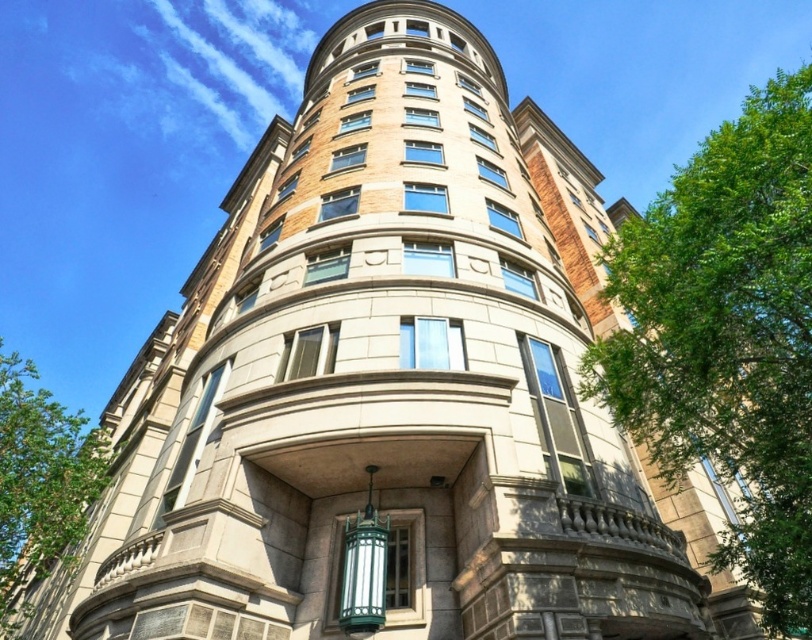
Question: Which of the following is the farthest from the observer?

Choices:
 (A) (98, 456)
 (B) (618, 230)

Answer: (B)

Question: Is green leafy tree at right further to camera compared to green leafy tree at lower left?

Choices:
 (A) yes
 (B) no

Answer: (B)

Question: Which point is farther to the camera?

Choices:
 (A) green leafy tree at lower left
 (B) green leafy tree at right

Answer: (A)

Question: Does green leafy tree at right have a larger size compared to green leafy tree at lower left?

Choices:
 (A) yes
 (B) no

Answer: (B)

Question: Where is green leafy tree at right located in relation to green leafy tree at lower left in the image?

Choices:
 (A) below
 (B) above

Answer: (B)